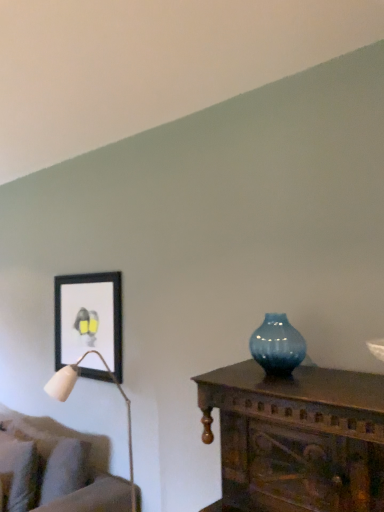
Identify the location of empty space that is ontop of blue glass vase at center (from a real-world perspective). Image resolution: width=384 pixels, height=512 pixels. (286, 302).